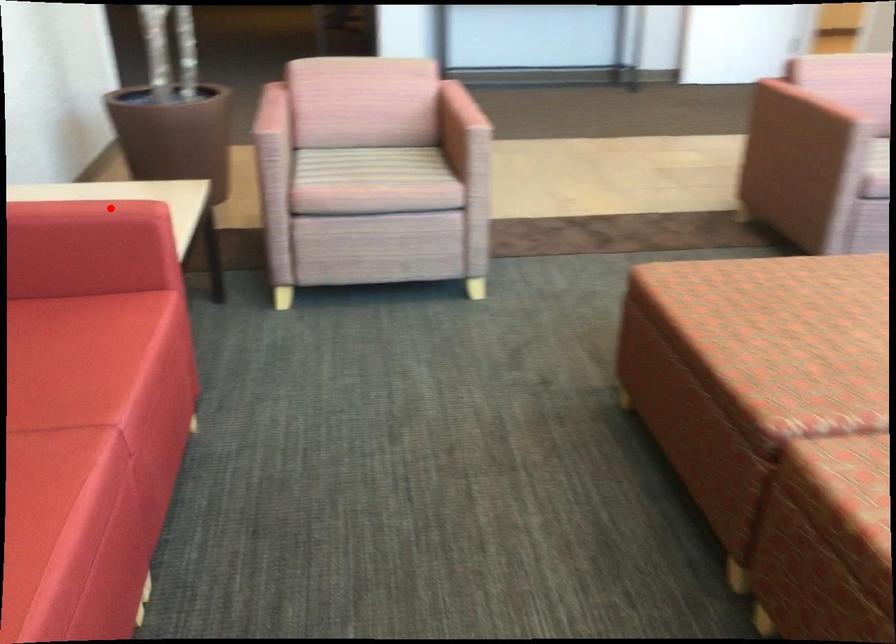
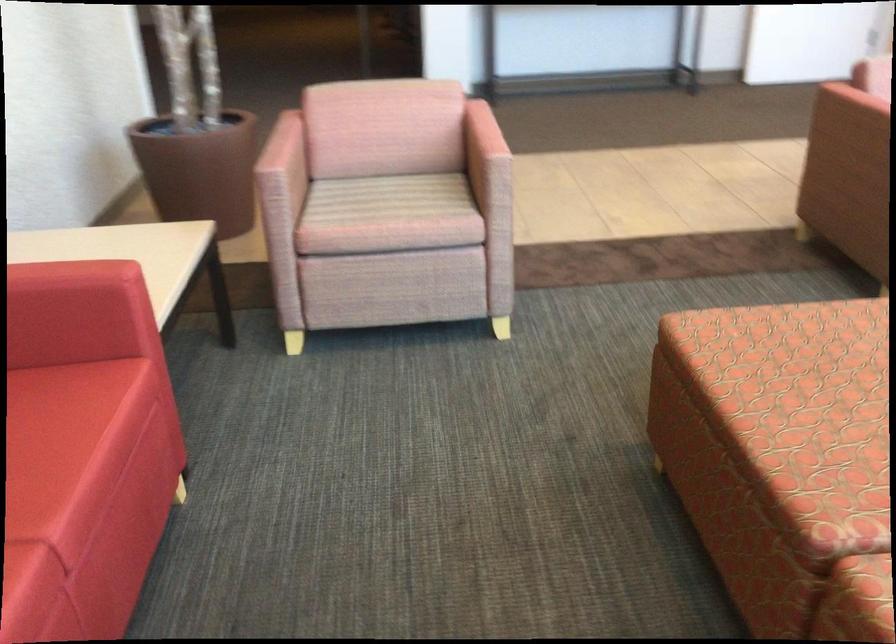
Locate, in the second image, the point that corresponds to the highlighted location in the first image.

(76, 272)